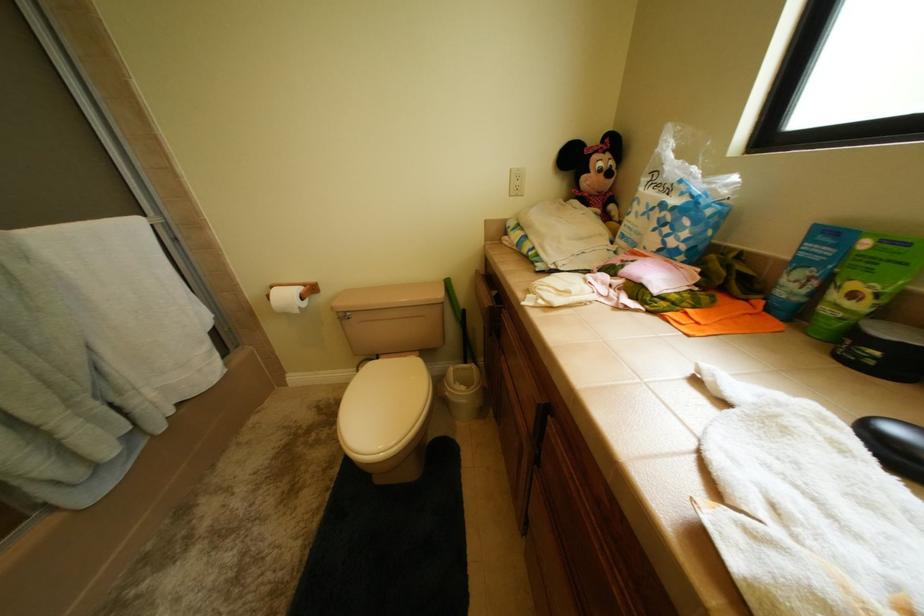
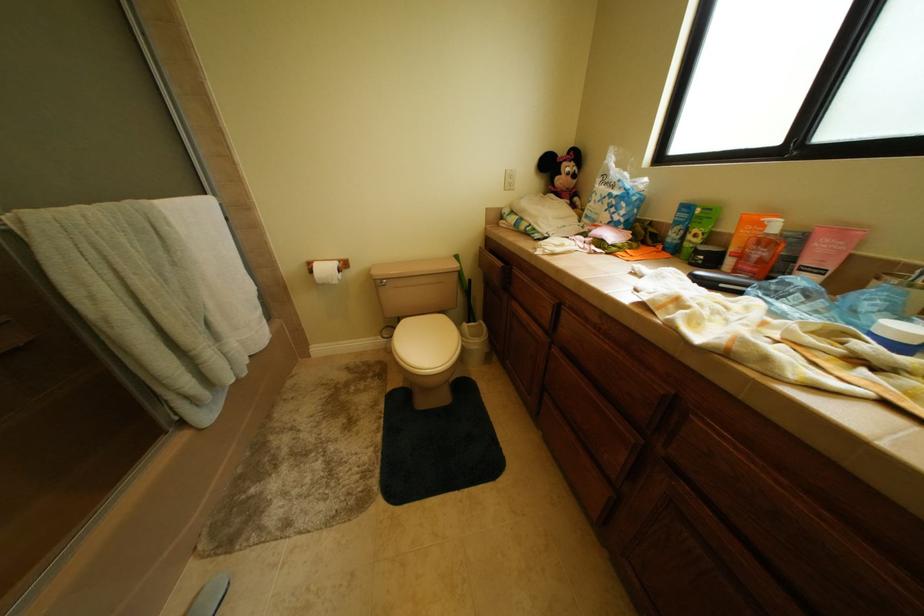
Which direction would the cameraman need to move to produce the second image?

The cameraman walked toward left, backward.